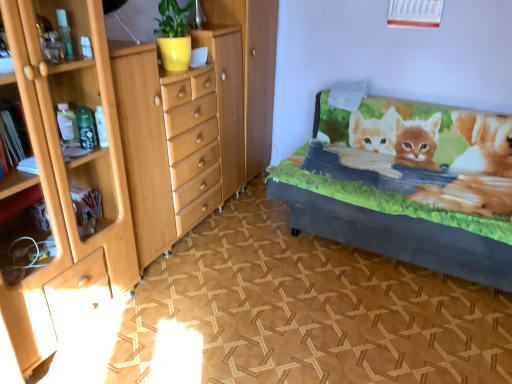
Where is `light wood chest of drawers at left`? This screenshot has width=512, height=384. light wood chest of drawers at left is located at coordinates (196, 121).

What do you see at coordinates (196, 121) in the screenshot? The width and height of the screenshot is (512, 384). I see `light wood chest of drawers at left` at bounding box center [196, 121].

This screenshot has height=384, width=512. What do you see at coordinates (412, 185) in the screenshot? I see `velvet gray bed frame at right` at bounding box center [412, 185].

I want to click on velvet gray bed frame at right, so click(412, 185).

Find the location of a particular element. light wood chest of drawers at left is located at coordinates (196, 121).

Considering the relative positions of velvet gray bed frame at right and light wood chest of drawers at left in the image provided, is velvet gray bed frame at right to the right of light wood chest of drawers at left from the viewer's perspective?

Correct, you'll find velvet gray bed frame at right to the right of light wood chest of drawers at left.

In the scene shown: Is the depth of velvet gray bed frame at right greater than that of light wood chest of drawers at left?

Yes, it is.

Which is less distant, (388, 192) or (210, 52)?

Clearly, point (388, 192) is closer to the camera than point (210, 52).

Looking at this image, from the image's perspective, is velvet gray bed frame at right positioned above or below light wood chest of drawers at left?

velvet gray bed frame at right is situated lower than light wood chest of drawers at left in the image.

From a real-world perspective, is velvet gray bed frame at right beneath light wood chest of drawers at left?

Correct, in the physical world, velvet gray bed frame at right is lower than light wood chest of drawers at left.

Is velvet gray bed frame at right wider than light wood chest of drawers at left?

Yes, velvet gray bed frame at right is wider than light wood chest of drawers at left.

Which of these two, velvet gray bed frame at right or light wood chest of drawers at left, stands taller?

Standing taller between the two is light wood chest of drawers at left.

Based on the photo, is velvet gray bed frame at right smaller than light wood chest of drawers at left?

Incorrect, velvet gray bed frame at right is not smaller in size than light wood chest of drawers at left.

Which is correct: velvet gray bed frame at right is inside light wood chest of drawers at left, or outside of it?

The correct answer is: outside.

Is velvet gray bed frame at right in contact with light wood chest of drawers at left?

No, velvet gray bed frame at right is not making contact with light wood chest of drawers at left.

Is velvet gray bed frame at right oriented away from light wood chest of drawers at left?

velvet gray bed frame at right does not have its back to light wood chest of drawers at left.

How many degrees apart are the facing directions of velvet gray bed frame at right and light wood chest of drawers at left?

velvet gray bed frame at right and light wood chest of drawers at left are facing 91.6 degrees away from each other.

This screenshot has height=384, width=512. In the image, there is a velvet gray bed frame at right. What are the coordinates of `the chest of drawers above it (from the image's perspective)` in the screenshot? It's located at (196, 121).

Is light wood chest of drawers at left to the left or to the right of velvet gray bed frame at right in the image?

In the image, light wood chest of drawers at left appears on the left side of velvet gray bed frame at right.

Considering the positions of objects light wood chest of drawers at left and velvet gray bed frame at right in the image provided, who is in front, light wood chest of drawers at left or velvet gray bed frame at right?

light wood chest of drawers at left is more forward.

Is point (206, 156) more distant than point (511, 196)?

Yes, it is behind point (511, 196).

From the image's perspective, is light wood chest of drawers at left beneath velvet gray bed frame at right?

No, from the image's perspective, light wood chest of drawers at left is not below velvet gray bed frame at right.

From a real-world perspective, is light wood chest of drawers at left positioned over velvet gray bed frame at right based on gravity?

Yes.

Considering the relative sizes of light wood chest of drawers at left and velvet gray bed frame at right in the image provided, is light wood chest of drawers at left wider than velvet gray bed frame at right?

Incorrect, the width of light wood chest of drawers at left does not surpass that of velvet gray bed frame at right.

Which of these two, light wood chest of drawers at left or velvet gray bed frame at right, stands shorter?

Standing shorter between the two is velvet gray bed frame at right.

Considering the sizes of light wood chest of drawers at left and velvet gray bed frame at right in the image, is light wood chest of drawers at left bigger or smaller than velvet gray bed frame at right?

Clearly, light wood chest of drawers at left is smaller in size than velvet gray bed frame at right.

Would you say light wood chest of drawers at left is outside velvet gray bed frame at right?

Yes, light wood chest of drawers at left is located beyond the bounds of velvet gray bed frame at right.

Would you consider light wood chest of drawers at left to be distant from velvet gray bed frame at right?

No, there isn't a large distance between light wood chest of drawers at left and velvet gray bed frame at right.

Is light wood chest of drawers at left turned away from velvet gray bed frame at right?

No, velvet gray bed frame at right is not at the back of light wood chest of drawers at left.

What's the angular difference between light wood chest of drawers at left and velvet gray bed frame at right's facing directions?

91.6 degrees separate the facing orientations of light wood chest of drawers at left and velvet gray bed frame at right.

Identify the location of the chest of drawers that appears above the velvet gray bed frame at right (from a real-world perspective). The width and height of the screenshot is (512, 384). (196, 121).

The height and width of the screenshot is (384, 512). What are the coordinates of `bed frame lying below the light wood chest of drawers at left (from the image's perspective)` in the screenshot? It's located at (412, 185).

I want to click on the chest of drawers above the velvet gray bed frame at right (from a real-world perspective), so click(196, 121).